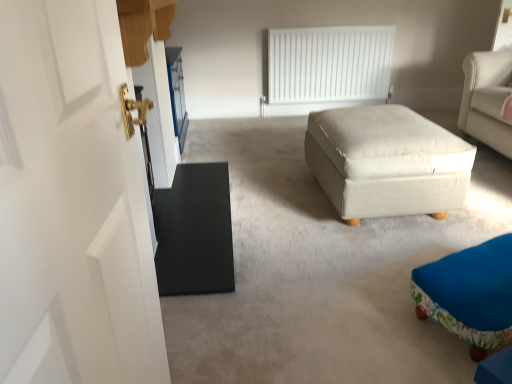
Question: Could you tell me if white matte radiator at upper center is facing black matte door at left?

Choices:
 (A) no
 (B) yes

Answer: (B)

Question: Considering the relative positions of white matte radiator at upper center and black matte door at left in the image provided, is white matte radiator at upper center to the right of black matte door at left from the viewer's perspective?

Choices:
 (A) no
 (B) yes

Answer: (A)

Question: Does white matte radiator at upper center have a lesser height compared to black matte door at left?

Choices:
 (A) no
 (B) yes

Answer: (A)

Question: Is white matte radiator at upper center bigger than black matte door at left?

Choices:
 (A) yes
 (B) no

Answer: (B)

Question: Is white matte radiator at upper center closer to the viewer compared to black matte door at left?

Choices:
 (A) no
 (B) yes

Answer: (A)

Question: Is white fabric ottoman at center, positioned as the first table in right-to-left order, wider or thinner than black matte door at left?

Choices:
 (A) thin
 (B) wide

Answer: (A)

Question: From the image's perspective, relative to black matte door at left, is white fabric ottoman at center, positioned as the first table in right-to-left order, above or below?

Choices:
 (A) above
 (B) below

Answer: (A)

Question: Considering the positions of white fabric ottoman at center, positioned as the first table in right-to-left order, and black matte door at left in the image, is white fabric ottoman at center, positioned as the first table in right-to-left order, bigger or smaller than black matte door at left?

Choices:
 (A) big
 (B) small

Answer: (B)

Question: Is white fabric ottoman at center, marked as the 2th table in a left-to-right arrangement, taller or shorter than black matte door at left?

Choices:
 (A) short
 (B) tall

Answer: (B)

Question: Is floral fabric ottoman at lower right taller or shorter than black matte table at left, marked as the first table in a left-to-right arrangement?

Choices:
 (A) short
 (B) tall

Answer: (B)

Question: Considering their positions, is floral fabric ottoman at lower right located in front of or behind black matte table at left, marked as the first table in a left-to-right arrangement?

Choices:
 (A) behind
 (B) front

Answer: (B)

Question: Considering the positions of point (498, 317) and point (178, 281), is point (498, 317) closer or farther from the camera than point (178, 281)?

Choices:
 (A) closer
 (B) farther

Answer: (A)

Question: From the image's perspective, is floral fabric ottoman at lower right positioned above or below black matte table at left, the 2th table when ordered from right to left?

Choices:
 (A) below
 (B) above

Answer: (A)

Question: Does point (476, 269) appear closer or farther from the camera than point (457, 198)?

Choices:
 (A) farther
 (B) closer

Answer: (B)

Question: From a real-world perspective, is floral fabric ottoman at lower right physically located above or below white fabric ottoman at center, positioned as the first table in right-to-left order?

Choices:
 (A) above
 (B) below

Answer: (B)